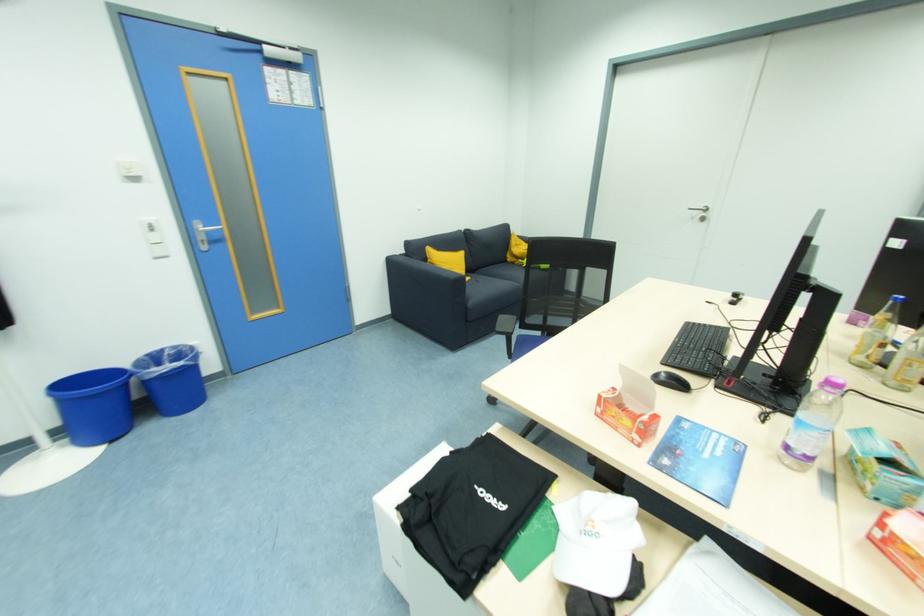
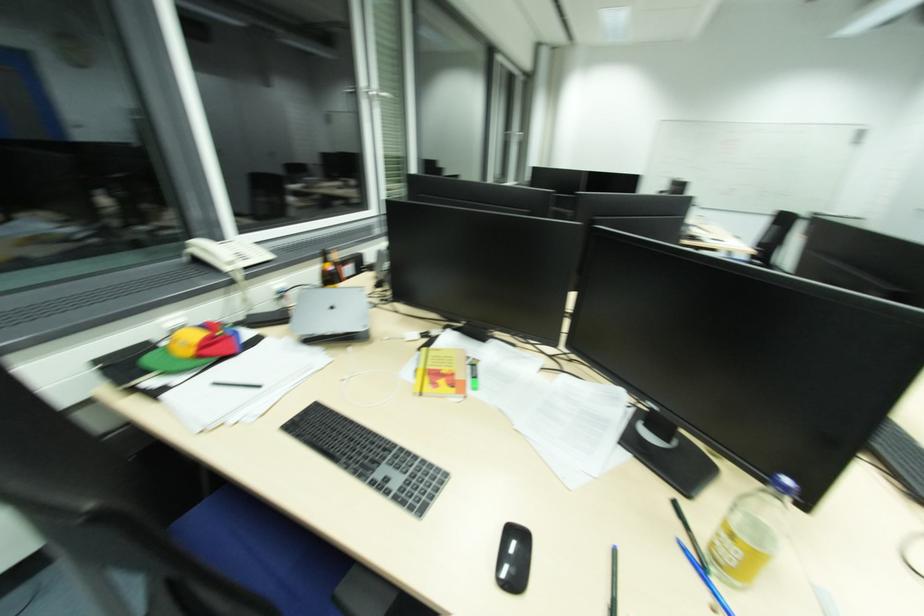
Question: I am providing you with two images of the same scene from different viewpoints. Which of the following objects are not visible in image2?

Choices:
 (A) white baseball cap
 (B) black chair armrest
 (C) red hair clip
 (D) blue pen

Answer: (A)